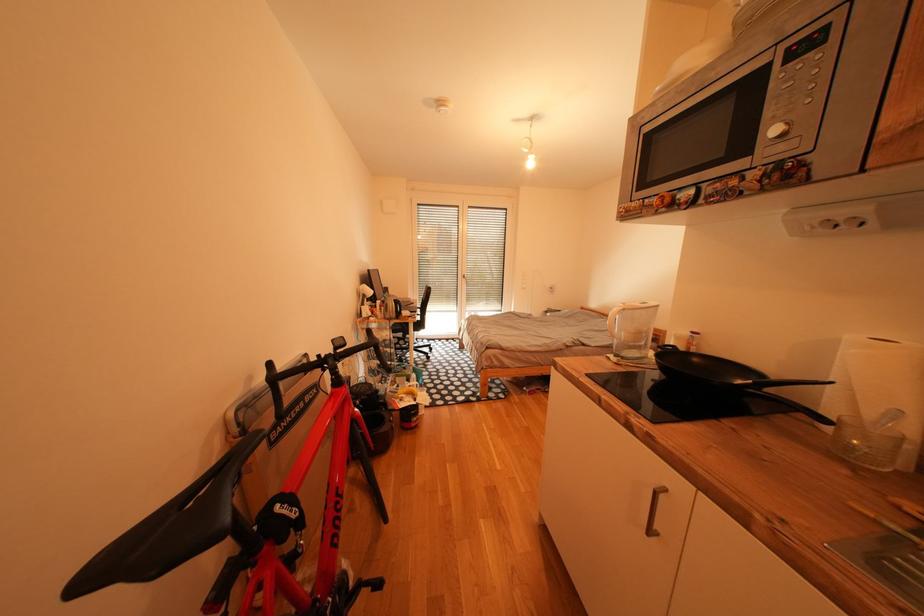
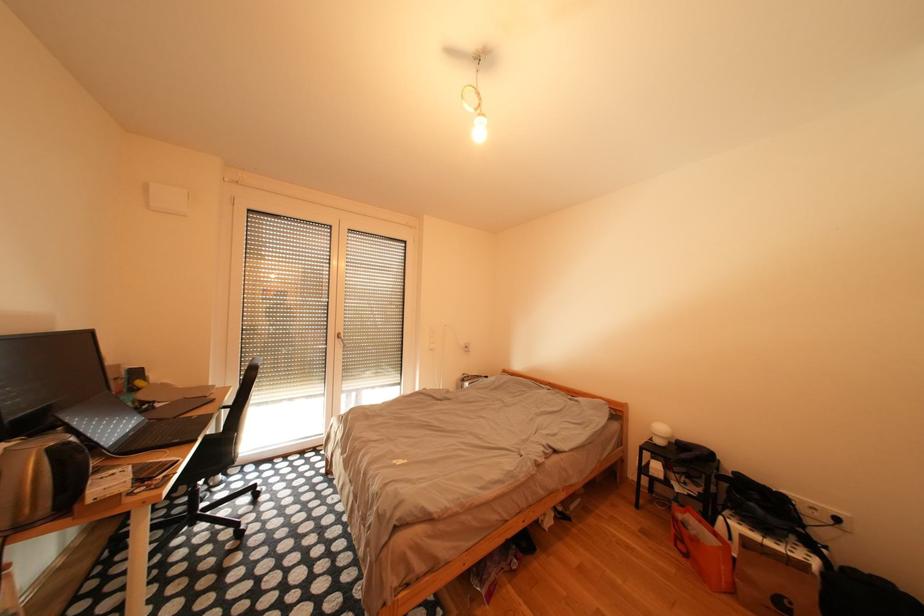
Question: In a continuous first-person perspective shot, in which direction is the camera moving?

Choices:
 (A) Left
 (B) Right
 (C) Forward
 (D) Backward

Answer: (C)